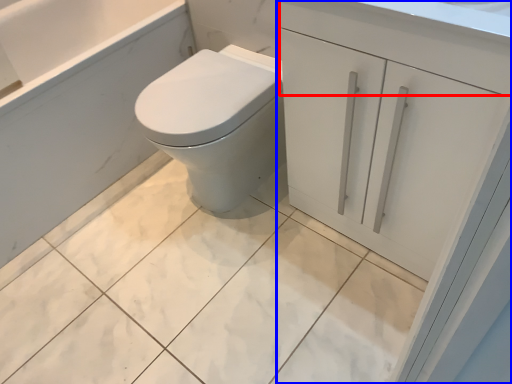
Question: Which point is closer to the camera, drawer (highlighted by a red box) or bathroom cabinet (highlighted by a blue box)?

Choices:
 (A) drawer
 (B) bathroom cabinet

Answer: (A)